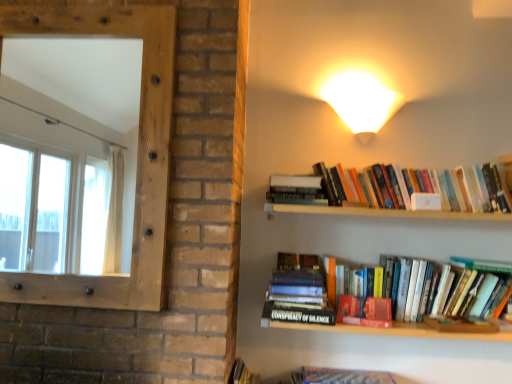
This screenshot has height=384, width=512. Identify the location of empty space that is ontop of natural wood frame at left. (79, 5).